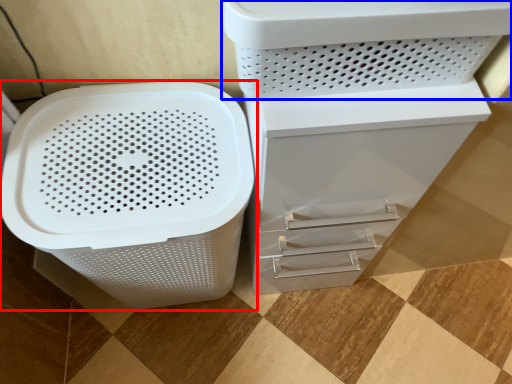
Question: Which object appears farthest to the camera in this image, waste container (highlighted by a red box) or appliance (highlighted by a blue box)?

Choices:
 (A) waste container
 (B) appliance

Answer: (A)